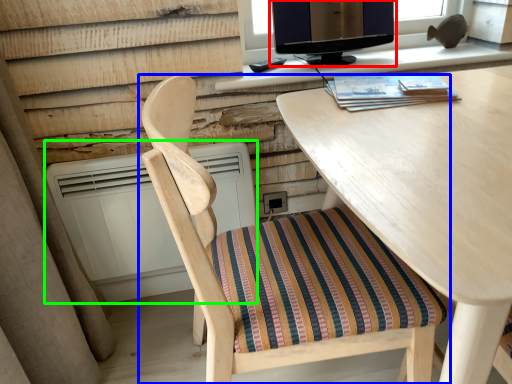
Question: Considering the real-world distances, which object is farthest from computer monitor (highlighted by a red box)? chair (highlighted by a blue box) or air conditioner (highlighted by a green box)?

Choices:
 (A) chair
 (B) air conditioner

Answer: (A)